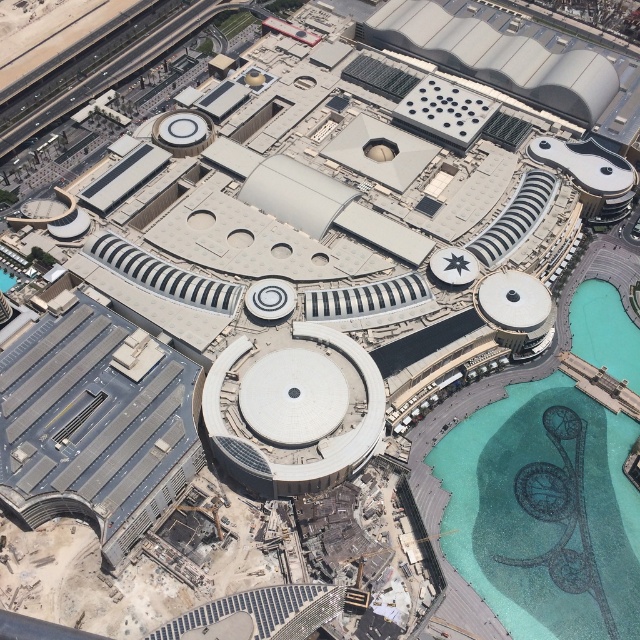
You are a visitor approaching the complex from the entrance located at the top of the image. As you walk towards the complex, which object will you encounter first between the turquoise mosaic pool at bottom right and the white matte dome at center?

The turquoise mosaic pool at bottom right will be encountered first because it is positioned in front of the white matte dome at center from the visitor approach direction.

You are a drone operator trying to capture the entire complex from above. You notice the turquoise mosaic pool at bottom right and the white matte dome at center. Which object would appear larger in your camera frame?

The turquoise mosaic pool at bottom right appears larger in the camera frame because it is much taller than the white matte dome at center.